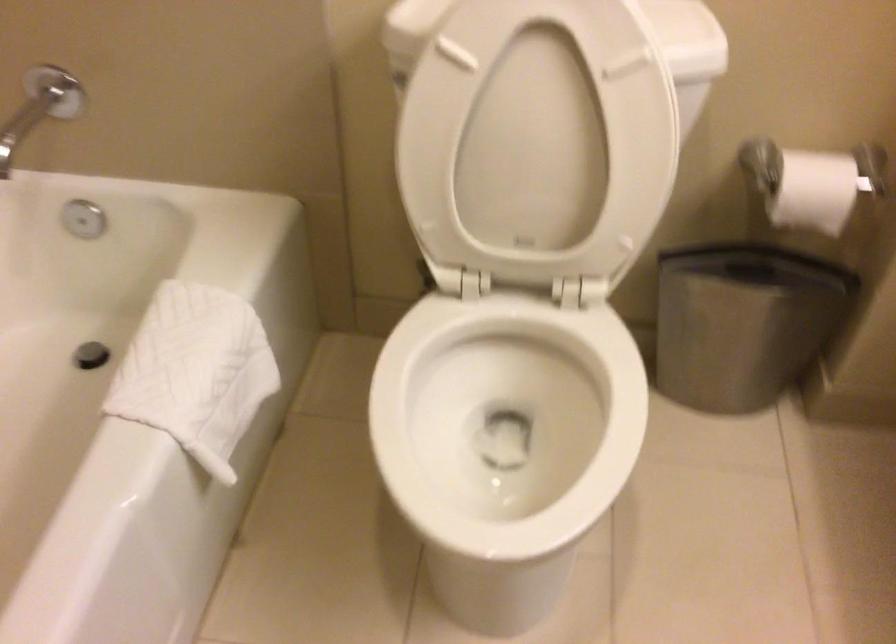
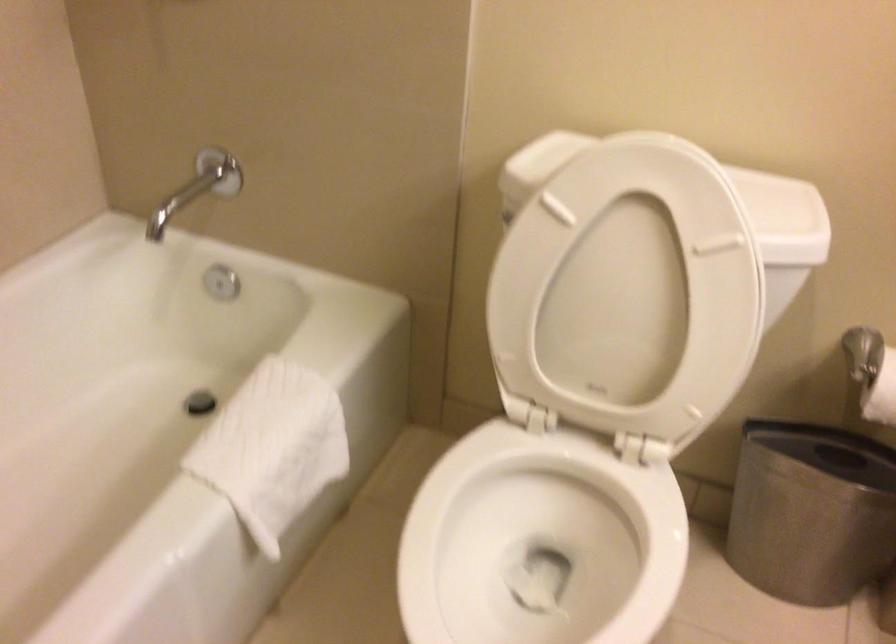
Find the pixel in the second image that matches [200,371] in the first image.

(272, 448)